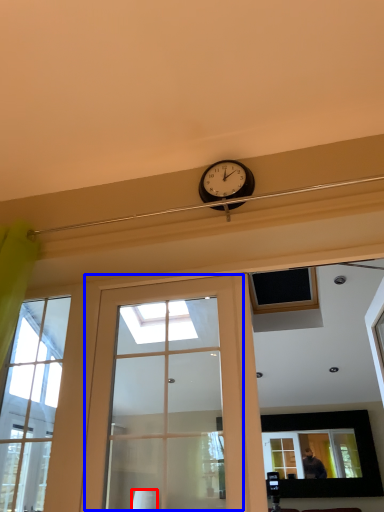
Question: Which object is closer to the camera taking this photo, lamp (highlighted by a red box) or door (highlighted by a blue box)?

Choices:
 (A) lamp
 (B) door

Answer: (B)